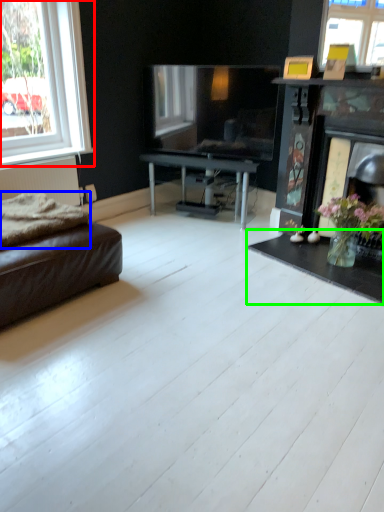
Question: Which object is positioned farthest from window (highlighted by a red box)? Select from blanket (highlighted by a blue box) and coffee table (highlighted by a green box).

Choices:
 (A) blanket
 (B) coffee table

Answer: (B)